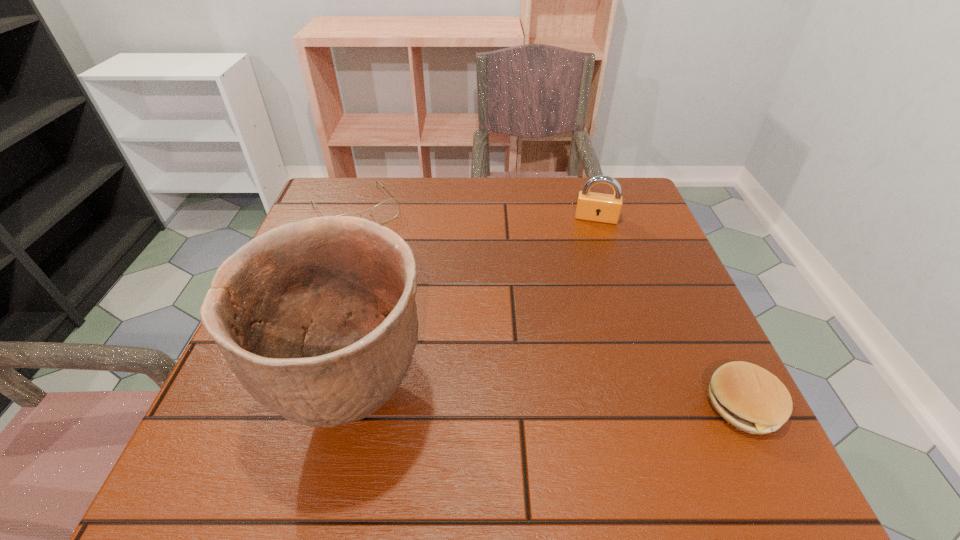
What are the coordinates of `free space located 0.100m on the front-facing side of the spectacles` in the screenshot? It's located at (390, 255).

At what (x,y) coordinates should I click in order to perform the action: click on free space located 0.270m on the front-facing side of the spectacles. Please return your answer as a coordinate pair (x, y). Looking at the image, I should click on (422, 298).

Identify the location of free region located 0.290m on the front-facing side of the spectacles. This screenshot has height=540, width=960. (427, 304).

The width and height of the screenshot is (960, 540). Find the location of `padlock that is at the far edge`. padlock that is at the far edge is located at coordinates (591, 206).

Identify the location of spectacles that is at the far edge. This screenshot has height=540, width=960. (389, 209).

Image resolution: width=960 pixels, height=540 pixels. I want to click on pottery at the near edge, so click(x=317, y=319).

This screenshot has height=540, width=960. What are the coordinates of `patty that is at the near edge` in the screenshot? It's located at (750, 398).

The width and height of the screenshot is (960, 540). What are the coordinates of `pottery present at the left edge` in the screenshot? It's located at (317, 319).

At what (x,y) coordinates should I click in order to perform the action: click on spectacles that is positioned at the left edge. Please return your answer as a coordinate pair (x, y). The width and height of the screenshot is (960, 540). Looking at the image, I should click on (389, 209).

Image resolution: width=960 pixels, height=540 pixels. In order to click on patty positioned at the right edge in this screenshot , I will do pos(750,398).